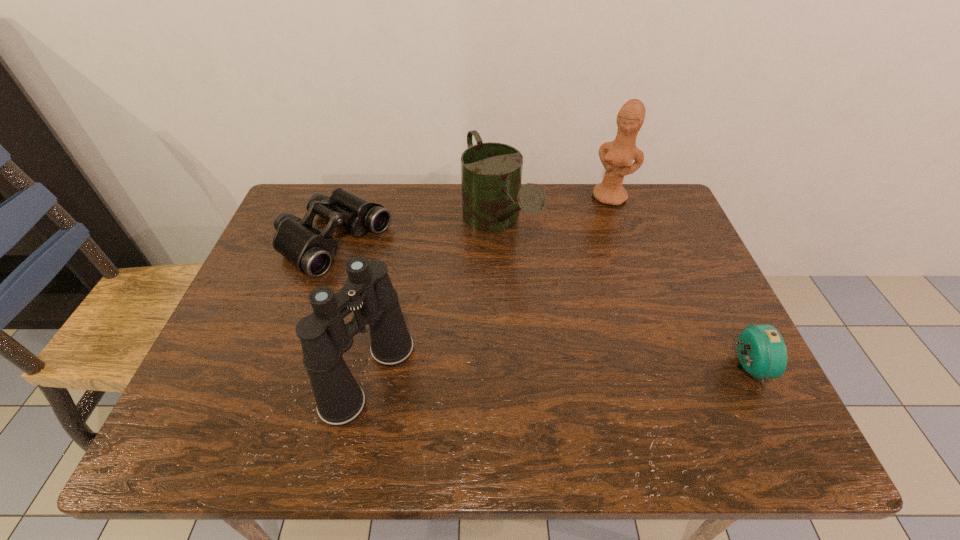
Identify the location of object that is the second closest one to the rightmost object. Image resolution: width=960 pixels, height=540 pixels. (617, 157).

Where is `vacant area in the image that satisfies the following two spatial constraints: 1. on the front side of the alarm clock; 2. on the front-facing side of the fourth object from left to right`? vacant area in the image that satisfies the following two spatial constraints: 1. on the front side of the alarm clock; 2. on the front-facing side of the fourth object from left to right is located at coordinates (671, 367).

Identify the location of vacant region that satisfies the following two spatial constraints: 1. on the front side of the figurine; 2. on the front-facing side of the rightmost object. This screenshot has height=540, width=960. (671, 367).

Find the location of a particular element. Image resolution: width=960 pixels, height=540 pixels. free spot that satisfies the following two spatial constraints: 1. on the back side of the nearer binoculars; 2. on the left side of the watering can is located at coordinates (399, 224).

Where is `free space that satisfies the following two spatial constraints: 1. on the back side of the taller binoculars; 2. on the front-facing side of the rightmost object`? This screenshot has width=960, height=540. free space that satisfies the following two spatial constraints: 1. on the back side of the taller binoculars; 2. on the front-facing side of the rightmost object is located at coordinates (371, 367).